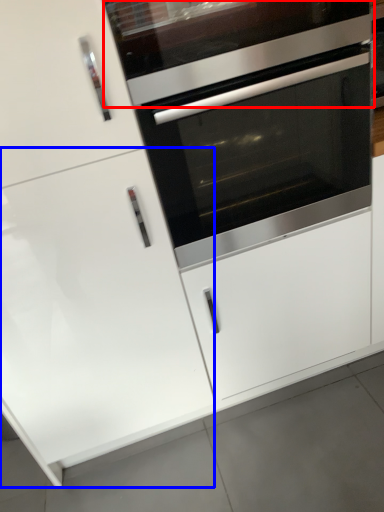
Question: Which object appears farthest to the camera in this image, vent (highlighted by a red box) or door (highlighted by a blue box)?

Choices:
 (A) vent
 (B) door

Answer: (A)